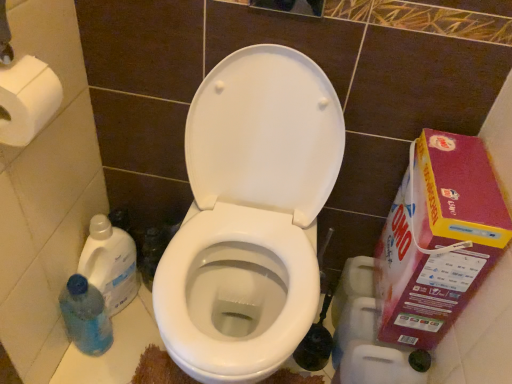
I want to click on blank space situated above pink cardboard box at right (from a real-world perspective), so click(464, 168).